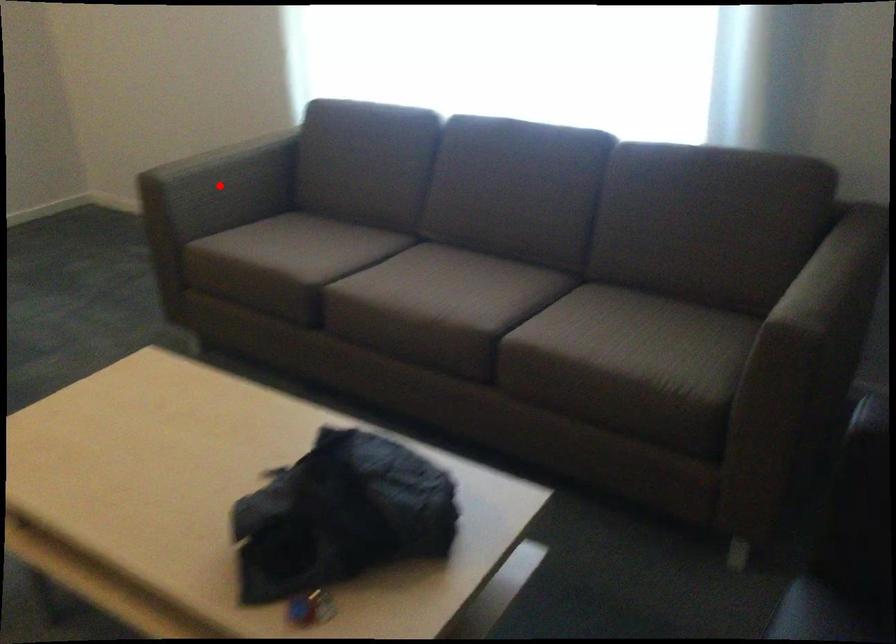
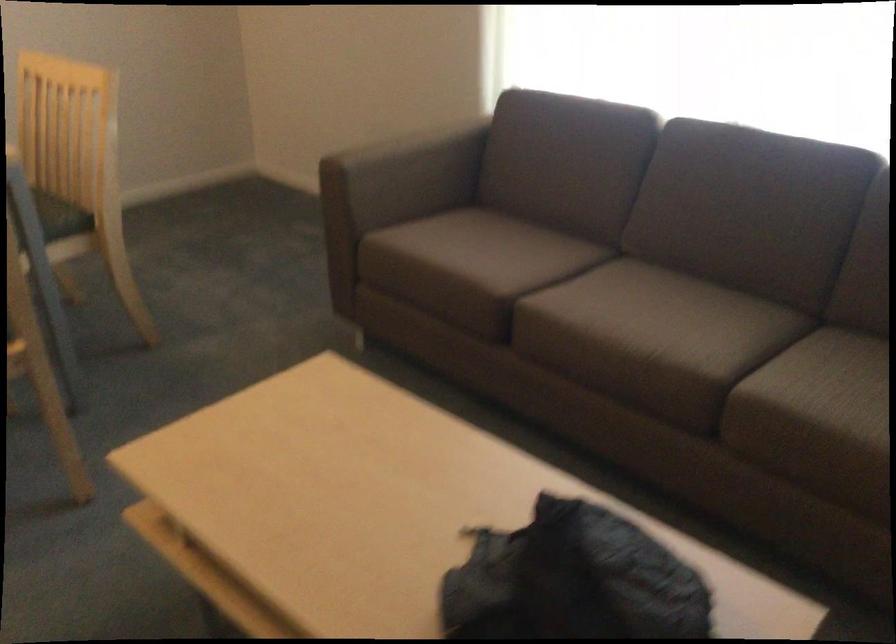
The point at the highlighted location is marked in the first image. Where is the corresponding point in the second image?

(403, 176)